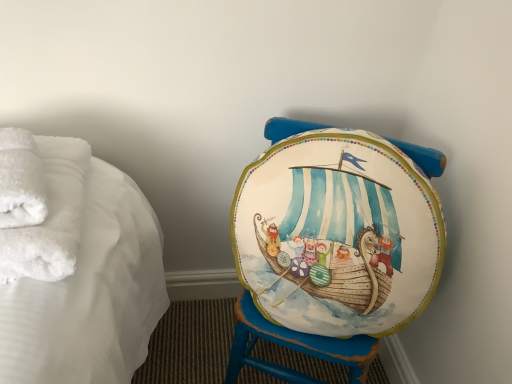
Question: In terms of width, does matte painted stool at center look wider or thinner when compared to white fluffy bath towel at left, the 2th bath towel in the back-to-front sequence?

Choices:
 (A) thin
 (B) wide

Answer: (B)

Question: Considering the positions of matte painted stool at center and white fluffy bath towel at left, the 2th bath towel in the back-to-front sequence, in the image, is matte painted stool at center taller or shorter than white fluffy bath towel at left, the 2th bath towel in the back-to-front sequence,?

Choices:
 (A) tall
 (B) short

Answer: (A)

Question: Which object is positioned closest to the white fluffy towels at left, the 2th bath towel positioned from the front?

Choices:
 (A) matte painted stool at center
 (B) white fluffy bath towel at left, marked as the 1th bath towel in a front-to-back arrangement

Answer: (B)

Question: Which object is positioned farthest from the white fluffy towels at left, the 2th bath towel positioned from the front?

Choices:
 (A) matte painted stool at center
 (B) white fluffy bath towel at left, the 2th bath towel in the back-to-front sequence

Answer: (A)